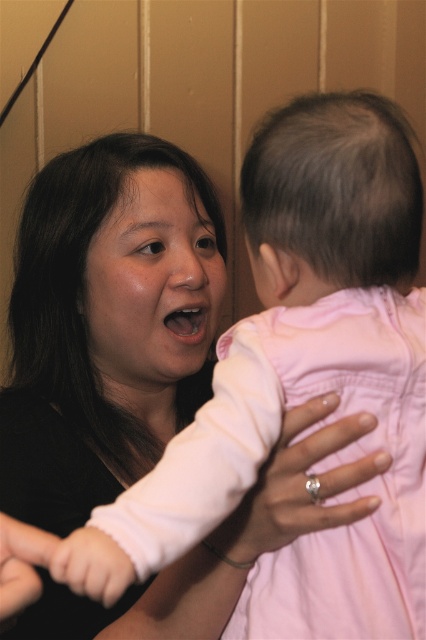
Question: Considering the relative positions of pink fabric baby hand at center and pink fabric hand at lower left in the image provided, where is pink fabric baby hand at center located with respect to pink fabric hand at lower left?

Choices:
 (A) left
 (B) right

Answer: (B)

Question: Considering the real-world distances, which object is closest to the pink fabric hand at center?

Choices:
 (A) pink fabric arm at center
 (B) pink fabric hand at lower left

Answer: (A)

Question: Which object is farther from the camera taking this photo?

Choices:
 (A) pink fabric hand at lower left
 (B) pink fabric arm at center
 (C) pink fabric hand at center

Answer: (B)

Question: Does pink fabric hand at center have a smaller size compared to pink fabric baby hand at center?

Choices:
 (A) no
 (B) yes

Answer: (A)

Question: In this image, where is pink fabric arm at center located relative to pink fabric hand at lower left?

Choices:
 (A) below
 (B) above

Answer: (A)

Question: Which object appears farthest from the camera in this image?

Choices:
 (A) pink fabric hand at center
 (B) pink fabric baby hand at center
 (C) pink fabric arm at center

Answer: (C)